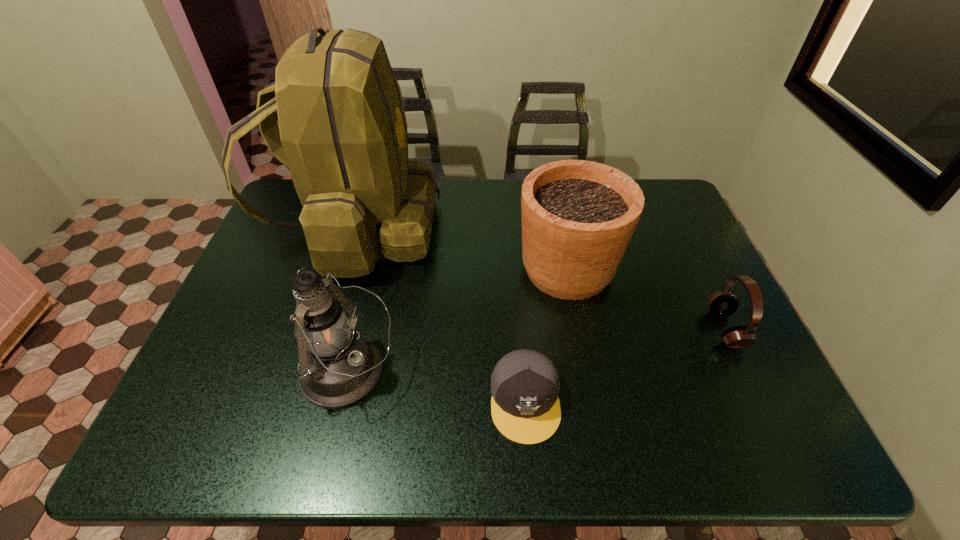
This screenshot has width=960, height=540. Find the location of `backpack`. backpack is located at coordinates (342, 134).

At what (x,y) coordinates should I click in order to perform the action: click on oil lamp. Please return your answer as a coordinate pair (x, y). The width and height of the screenshot is (960, 540). Looking at the image, I should click on [x=338, y=367].

Locate an element on the screen. the third tallest object is located at coordinates (578, 216).

I want to click on the second shortest object, so click(x=721, y=304).

The width and height of the screenshot is (960, 540). I want to click on the rightmost object, so [721, 304].

Locate an element on the screen. the shortest object is located at coordinates (525, 408).

Find the location of a particular element. vacant space located 0.180m on the front-facing side of the tallest object is located at coordinates (494, 228).

At what (x,y) coordinates should I click in order to perform the action: click on vacant position located 0.110m on the back of the oil lamp. Please return your answer as a coordinate pair (x, y). The image size is (960, 540). Looking at the image, I should click on (365, 303).

Locate an element on the screen. This screenshot has height=540, width=960. free spot located 0.200m on the front of the flowerpot is located at coordinates (588, 375).

Identify the location of vacant space situated on the ear pads of the fourth tallest object. (608, 329).